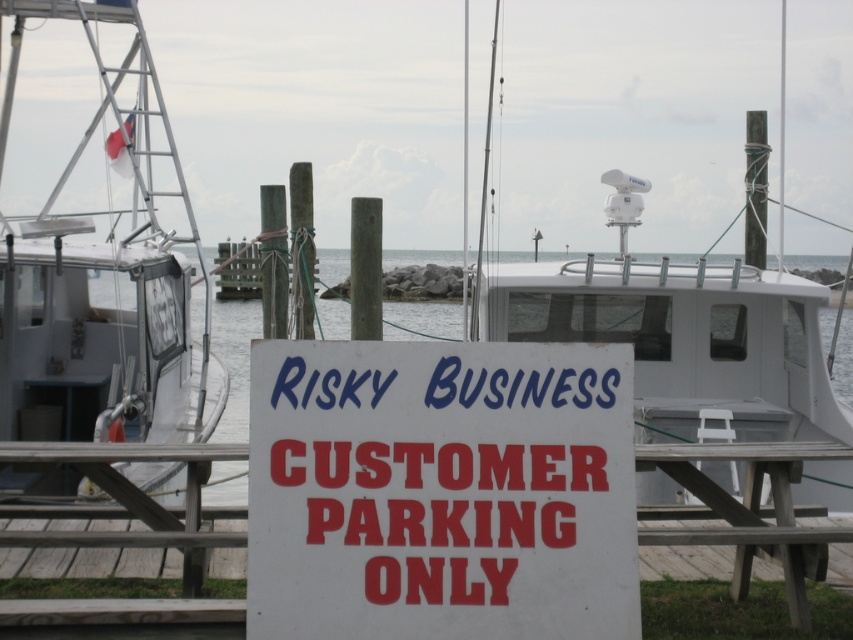
You are a visitor at the dock and want to sit down for a snack. There is a transparent water at center and a wooden picnic table at center. Which one is a suitable place to sit?

The wooden picnic table at center is a suitable place to sit because the transparent water at center is above it and likely part of the dock or structure, making the picnic table the appropriate seating option.

What is the exact coordinate of the transparent water at center?

The transparent water at center is located at point (692, 344).